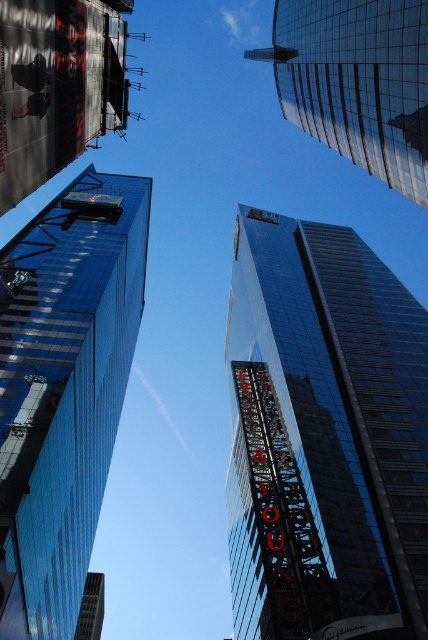
Is the position of black glass building at center more distant than that of shiny glass skyscraper at upper center?

Yes, it is.

Which is below, black glass building at center or shiny glass skyscraper at upper center?

black glass building at center is below.

Is point (321, 628) positioned in front of point (293, 33)?

Yes, it is.

Identify the location of black glass building at center. This screenshot has height=640, width=428. (323, 436).

Between point (376, 369) and point (58, 76), which one is positioned in front?

Positioned in front is point (58, 76).

Who is more distant from viewer, (261, 332) or (0, 122)?

Positioned behind is point (261, 332).

Where is `black glass building at center`? This screenshot has width=428, height=640. black glass building at center is located at coordinates (323, 436).

Measure the distance between point [285,16] and camera.

The distance of point [285,16] from camera is 269.86 feet.

Is point (285, 104) behind point (124, 125)?

Yes, it is.

Find the location of `shiny glass skyscraper at upper center`. shiny glass skyscraper at upper center is located at coordinates (356, 81).